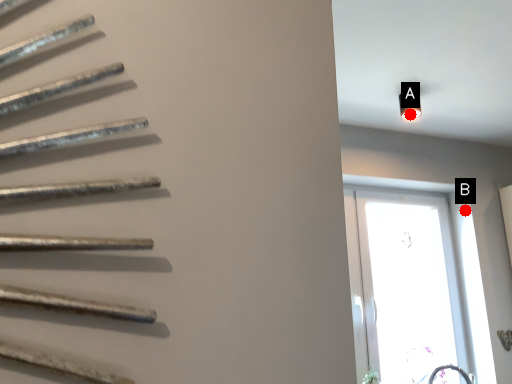
Question: Two points are circled on the image, labeled by A and B beside each circle. Which point is farther from the camera taking this photo?

Choices:
 (A) A is further
 (B) B is further

Answer: (B)